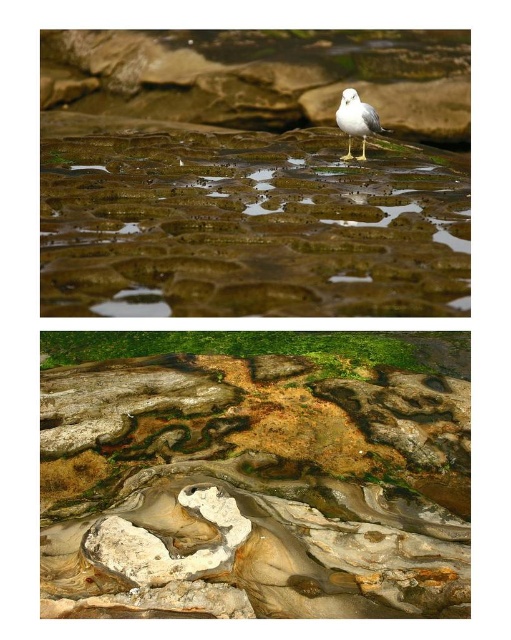
In the scene shown: Which is below, translucent wet rock at center or white matte bird at center?

translucent wet rock at center

Is translucent wet rock at center smaller than white matte bird at center?

Incorrect, translucent wet rock at center is not smaller in size than white matte bird at center.

Find the location of a particular element. translucent wet rock at center is located at coordinates (245, 221).

At what (x,y) coordinates should I click in order to perform the action: click on translucent wet rock at center. Please return your answer as a coordinate pair (x, y). This screenshot has height=640, width=511. Looking at the image, I should click on (245, 221).

Is rough textured rock at center shorter than translucent wet rock at center?

Yes.

Who is positioned more to the right, rough textured rock at center or translucent wet rock at center?

Positioned to the right is translucent wet rock at center.

Does point (160, 525) come closer to viewer compared to point (80, 209)?

No, (160, 525) is behind (80, 209).

The image size is (511, 640). I want to click on rough textured rock at center, so click(x=252, y=488).

Between rough textured rock at center and white matte bird at center, which one appears on the right side from the viewer's perspective?

Positioned to the right is white matte bird at center.

Can you confirm if rough textured rock at center is wider than white matte bird at center?

Indeed, rough textured rock at center has a greater width compared to white matte bird at center.

Identify the location of rough textured rock at center. The width and height of the screenshot is (511, 640). (252, 488).

Where is `rough textured rock at center`? rough textured rock at center is located at coordinates (252, 488).